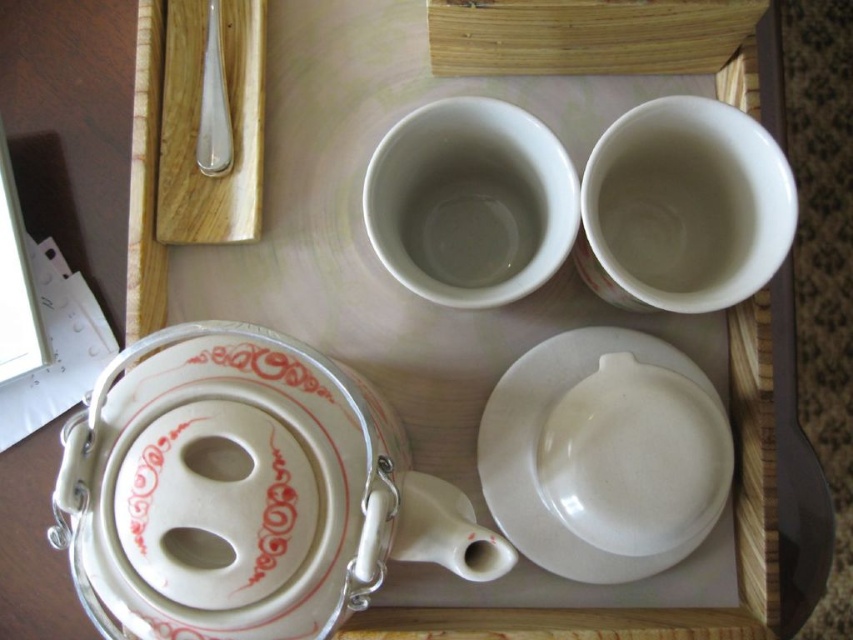
You are setting up a tea service and need to place the white glossy teapot at bottom left and the white glossy platter at center on the tray. According to the image, where should you place the teapot in relation to the platter?

The white glossy teapot at bottom left should be placed under the white glossy platter at center as it is positioned under it in the image.

Looking at this image, you are holding a smartphone with a 6.5 inch screen. You want to take a photo of the white glossy teapot at bottom left. Can you fit the entire teapot into the frame without zooming in?

The white glossy teapot at bottom left is 16.33 inches from viewer. Since the smartphone screen is only 6.5 inches, the teapot is too far away to fit entirely within the frame without zooming in.

You are setting up a tea service and need to place the white glossy teapot at bottom left and the white glossy platter at center on a shelf. The shelf has a height limit of 12 inches. Can both items fit vertically without exceeding the height limit?

The white glossy teapot at bottom left is shorter than the white glossy platter at center. Since the shelf has a height limit of 12 inches, both items can fit vertically as long as the tallest item, the white glossy platter at center, is under 12 inches. However, without knowing the exact height of the platter, we cannot confirm if it meets the limit.